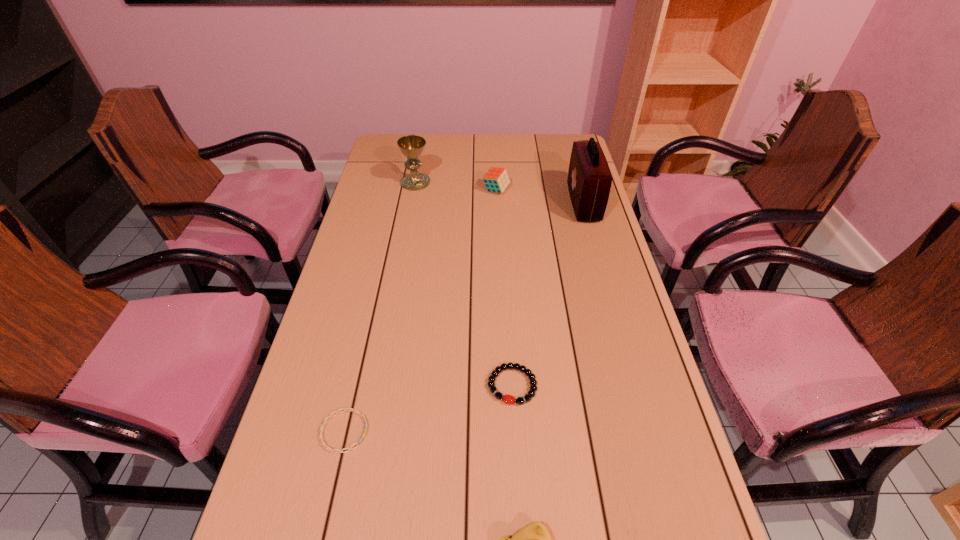
Identify which object is located as the fifth nearest to the nearest object. Please provide its 2D coordinates. Your answer should be formatted as a tuple, i.e. [(x, y)], where the tuple contains the x and y coordinates of a point satisfying the conditions above.

[(411, 146)]

You are a GUI agent. You are given a task and a screenshot of the screen. Output one action in this format:
    pyautogui.click(x=<x>, y=<y>)
    Task: Click on the free spot that satisfies the following two spatial constraints: 1. on the front side of the second tallest object; 2. on the surface of the second nearest object showing star-shaped elements
    Image resolution: width=960 pixels, height=540 pixels.
    Given the screenshot: What is the action you would take?
    pyautogui.click(x=370, y=431)

Identify the location of blank area in the image that satisfies the following two spatial constraints: 1. on the front side of the second tallest object; 2. on the surface of the shortest object showing star-shaped elements. The width and height of the screenshot is (960, 540). (370, 431).